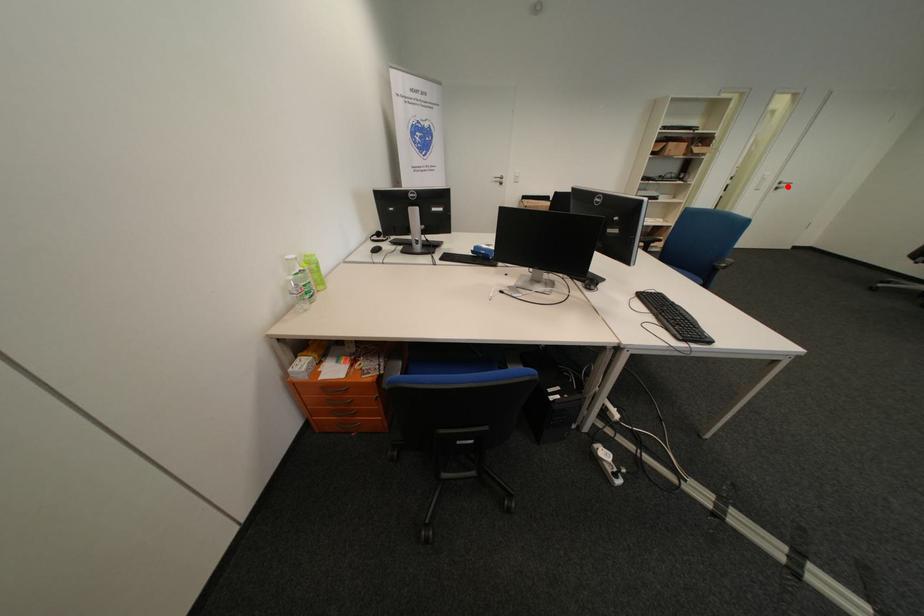
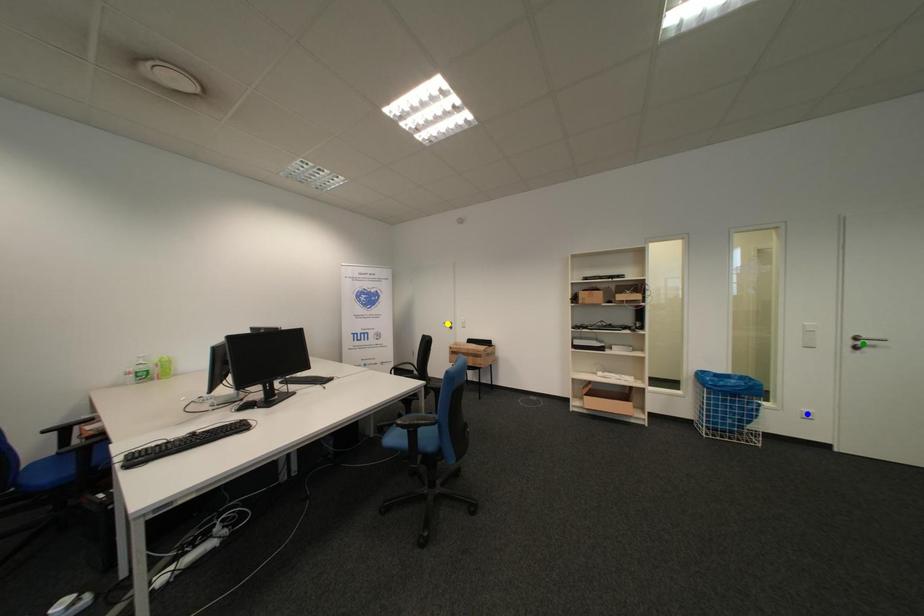
Question: I am providing you with two images of the same scene from different viewpoints. A red point is marked on the first image. You are given multiple points on the second image. Can you choose the point in image 2 that corresponds to the point in image 1?

Choices:
 (A) yellow point
 (B) blue point
 (C) green point

Answer: (C)